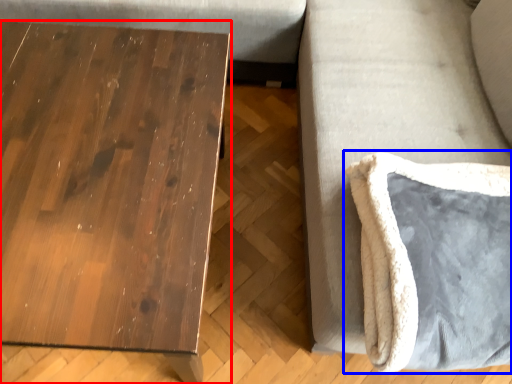
Question: Which object appears closest to the camera in this image, table (highlighted by a red box) or swivel chair (highlighted by a blue box)?

Choices:
 (A) table
 (B) swivel chair

Answer: (B)